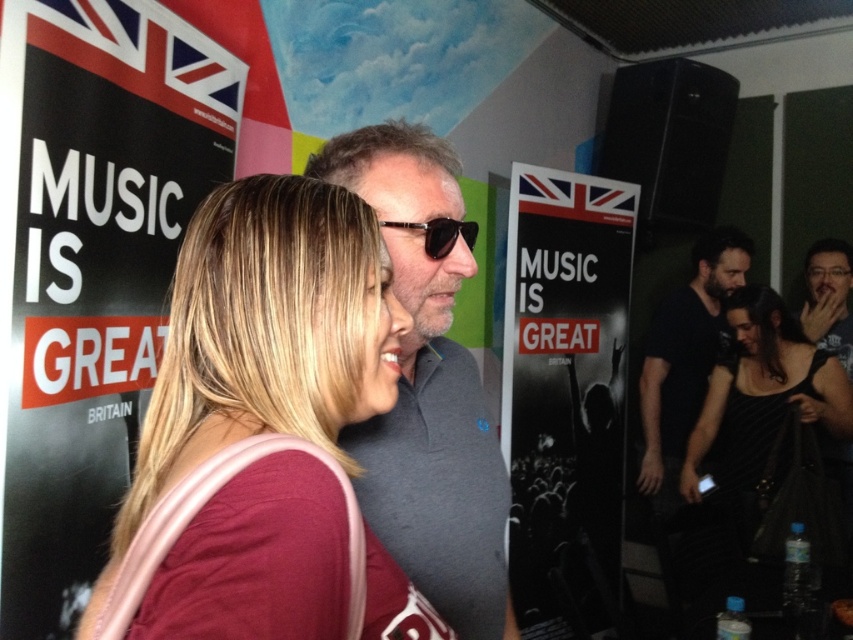
Is black mesh tank top at right shorter than black reflective sunglasses at center?

In fact, black mesh tank top at right may be taller than black reflective sunglasses at center.

Can you confirm if black mesh tank top at right is wider than black reflective sunglasses at center?

Indeed, black mesh tank top at right has a greater width compared to black reflective sunglasses at center.

Does point (741, 401) come farther from viewer compared to point (469, 241)?

That is True.

This screenshot has width=853, height=640. In order to click on black mesh tank top at right in this screenshot , I will do `click(753, 428)`.

Describe the element at coordinates (753, 428) in the screenshot. The height and width of the screenshot is (640, 853). I see `black mesh tank top at right` at that location.

Is black mesh tank top at right taller than black matte shirt at right?

No, black mesh tank top at right is not taller than black matte shirt at right.

Measure the distance between point (706, 595) and camera.

The distance of point (706, 595) from camera is 6.94 feet.

Identify the location of black mesh tank top at right. (753, 428).

Is black paper poster at center wider than black reflective sunglasses at center?

Yes, black paper poster at center is wider than black reflective sunglasses at center.

Who is taller, black paper poster at center or black reflective sunglasses at center?

Standing taller between the two is black paper poster at center.

Between point (563, 513) and point (469, 228), which one is positioned in front?

Point (469, 228)

This screenshot has height=640, width=853. Identify the location of black paper poster at center. (566, 396).